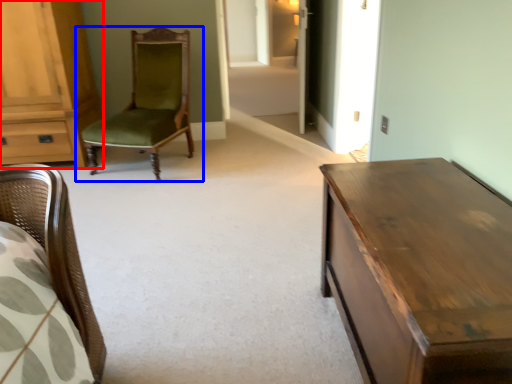
Question: Among these objects, which one is farthest to the camera, cabinetry (highlighted by a red box) or chair (highlighted by a blue box)?

Choices:
 (A) cabinetry
 (B) chair

Answer: (A)